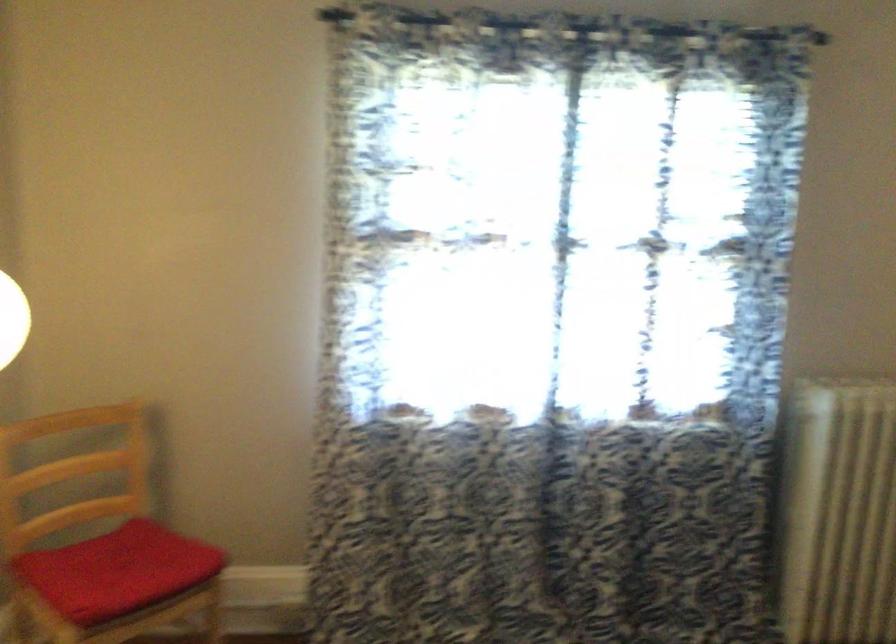
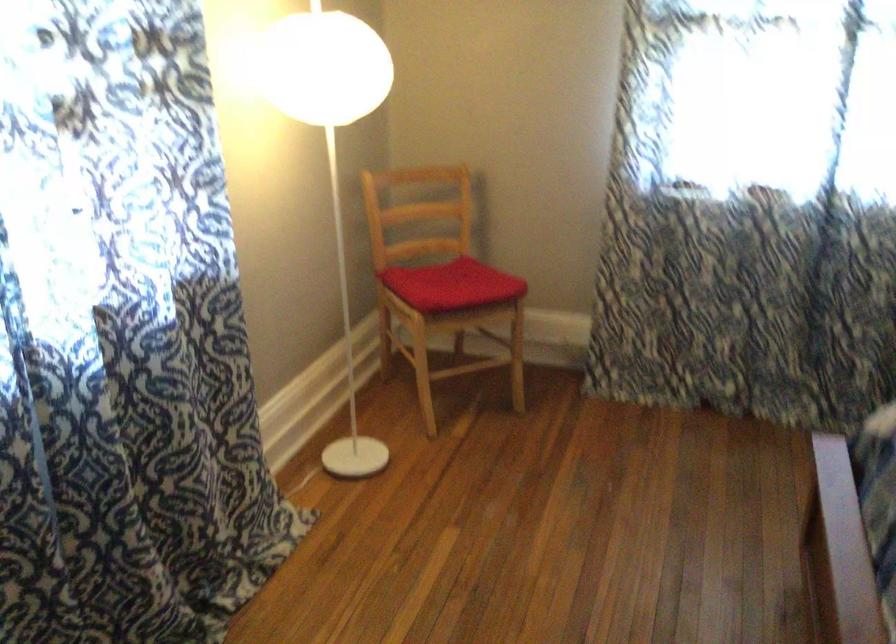
Question: The camera is either moving clockwise (left) or counter-clockwise (right) around the object. The first image is from the beginning of the video and the second image is from the end. Is the camera moving left or right when shooting the video?

Choices:
 (A) Left
 (B) Right

Answer: (B)